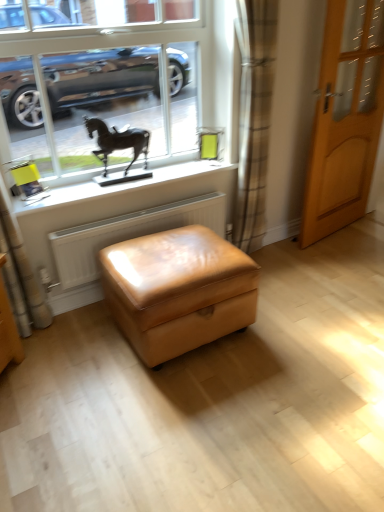
Where is `vacant space that is in between leather ottoman at center and light brown wooden door at right`? This screenshot has height=512, width=384. vacant space that is in between leather ottoman at center and light brown wooden door at right is located at coordinates (295, 275).